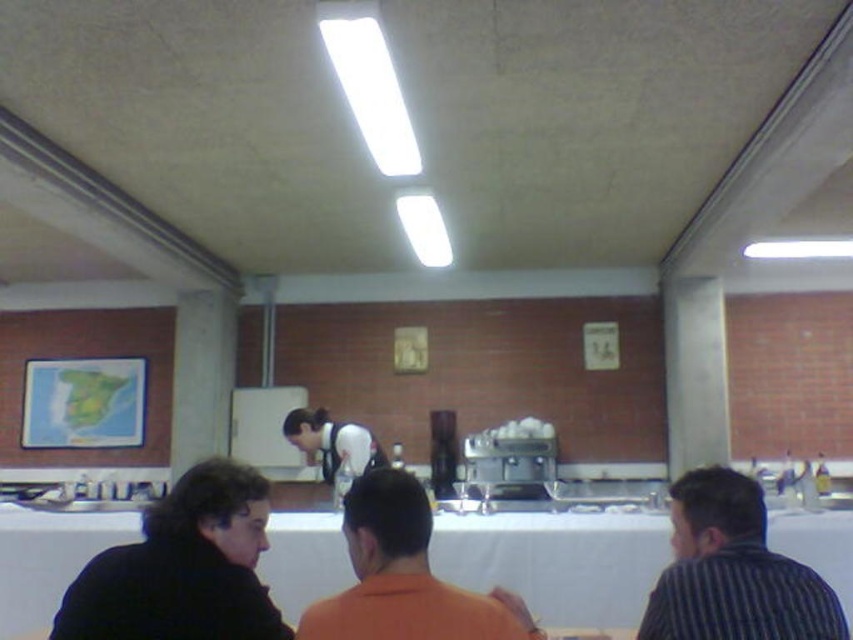
Based on the photo, you are standing at the camera position in the cafeteria scene. There is a white fabric table at lower center. If you want to walk to the table, how many steps would you need to take if each step covers 0.75 meters?

The distance between the camera and the white fabric table at lower center is 3.05 meters. Each step covers 0.75 meters. Dividing 3.05 by 0.75 gives approximately 4.07 steps. Since you can only take whole steps, you would need to take 5 steps to reach the table.

You are a server in a busy cafeteria and need to place a large tray of food. You see the white fabric table at lower center and the white fabric apron at center. Which surface is more suitable for placing the tray without it being too small?

The white fabric table at lower center is bigger than the white fabric apron at center, so the white fabric table at lower center is more suitable for placing the large tray of food as it provides a larger surface area.